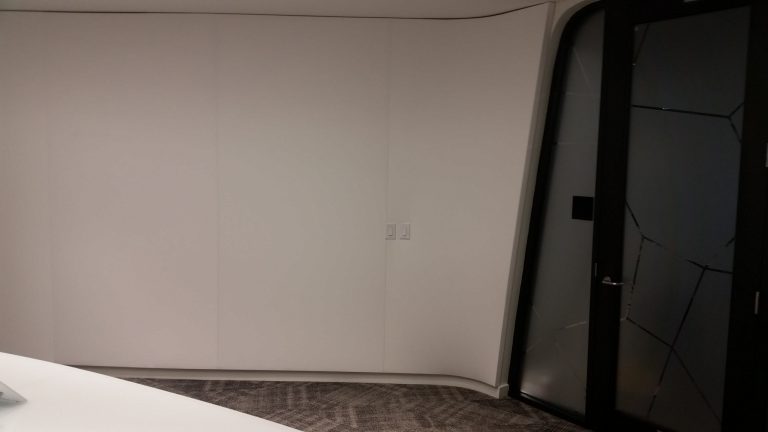
Locate an element on the screen. white wall is located at coordinates (424, 154), (303, 159), (217, 411).